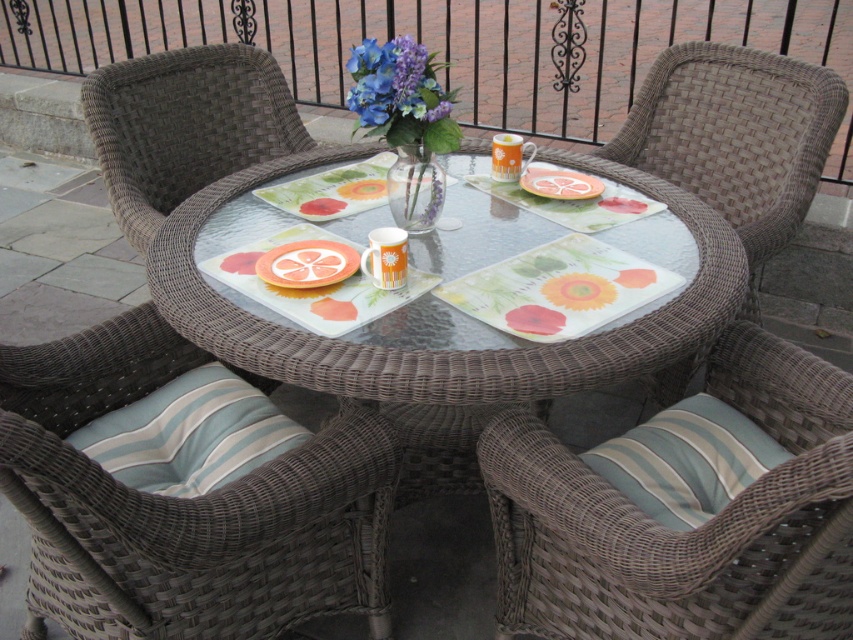
Is woven brown chair at upper right in front of matte glass vase at center?

No, woven brown chair at upper right is behind matte glass vase at center.

From the picture: Can you confirm if woven brown chair at upper right is smaller than matte glass vase at center?

No, woven brown chair at upper right is not smaller than matte glass vase at center.

Image resolution: width=853 pixels, height=640 pixels. What do you see at coordinates (735, 136) in the screenshot?
I see `woven brown chair at upper right` at bounding box center [735, 136].

The width and height of the screenshot is (853, 640). What are the coordinates of `woven brown chair at upper right` in the screenshot? It's located at tap(735, 136).

Is point (593, 300) behind point (540, 172)?

No, it is not.

Is yellow matte flower at center shorter than orange glossy platter at center?

Correct, yellow matte flower at center is not as tall as orange glossy platter at center.

The width and height of the screenshot is (853, 640). What are the coordinates of `yellow matte flower at center` in the screenshot? It's located at (578, 291).

Is point (265, 262) in front of point (585, 173)?

Yes, point (265, 262) is closer to viewer.

Can you confirm if translucent glass platter at center is taller than orange glossy platter at center?

Correct, translucent glass platter at center is much taller as orange glossy platter at center.

Locate an element on the screen. translucent glass platter at center is located at coordinates (306, 262).

The height and width of the screenshot is (640, 853). I want to click on translucent glass platter at center, so click(306, 262).